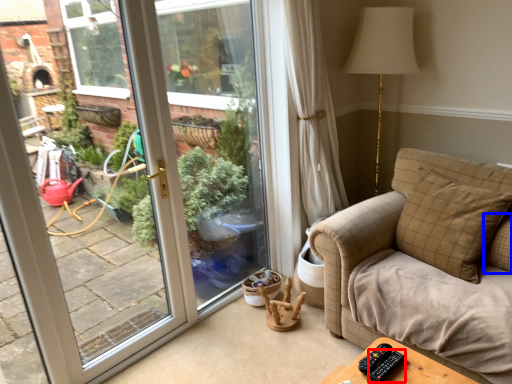
Question: Among these objects, which one is nearest to the camera, remote (highlighted by a red box) or pillow (highlighted by a blue box)?

Choices:
 (A) remote
 (B) pillow

Answer: (A)